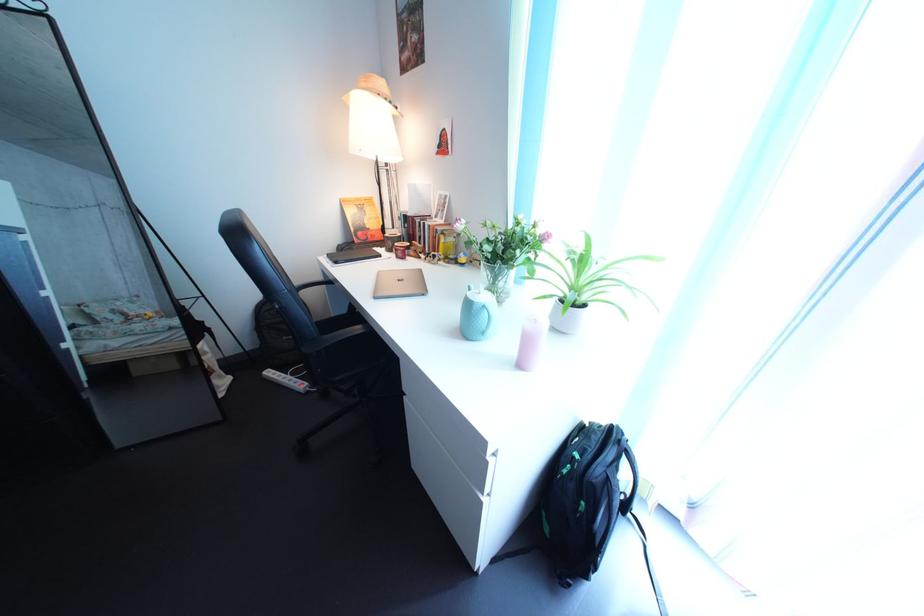
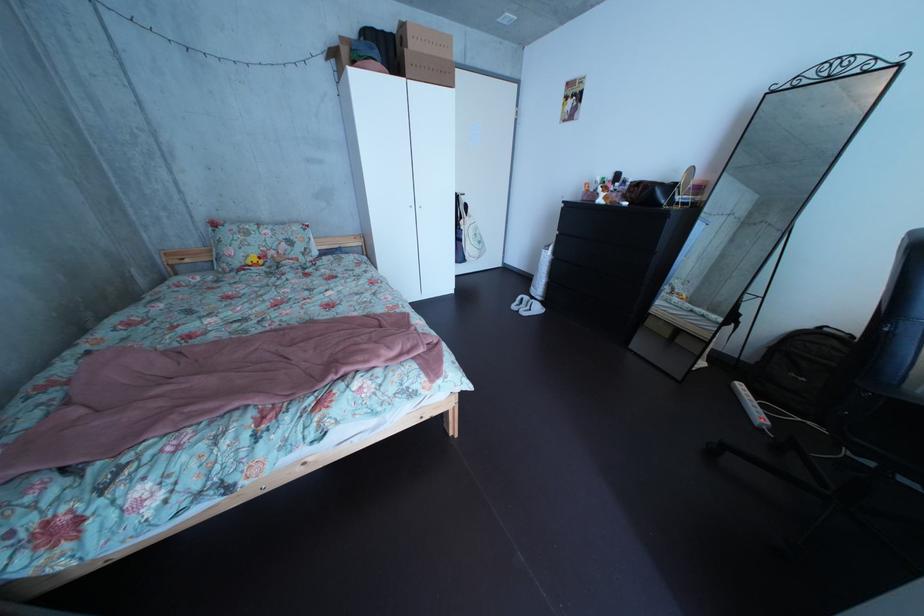
Question: I am providing you with two images of the same scene from different viewpoints. Please identify which objects are invisible in image2.

Choices:
 (A) white slippers
 (B) yellow plush toy
 (C) bottle pump head
 (D) none of these

Answer: (D)